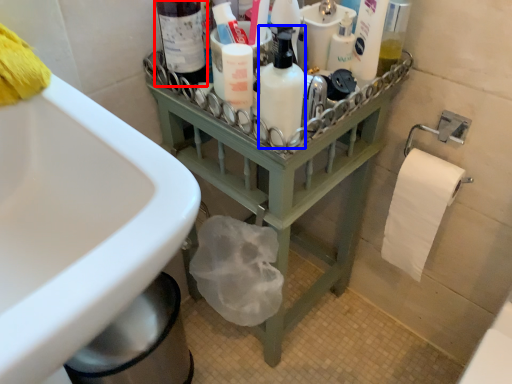
Question: Among these objects, which one is nearest to the camera, bottle (highlighted by a red box) or cleaning product (highlighted by a blue box)?

Choices:
 (A) bottle
 (B) cleaning product

Answer: (B)